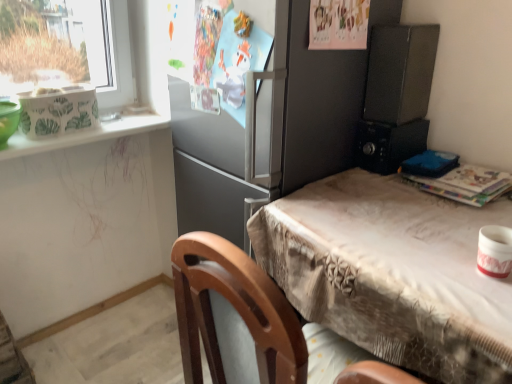
Identify the location of vacant space behind white glossy mug at upper right, the 1th appliance in the bottom-to-top sequence. (448, 235).